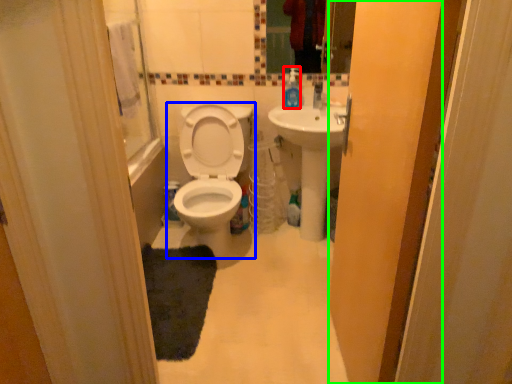
Question: Estimate the real-world distances between objects in this image. Which object is farther from soap dispenser (highlighted by a red box), toilet (highlighted by a blue box) or screen door (highlighted by a green box)?

Choices:
 (A) toilet
 (B) screen door

Answer: (B)